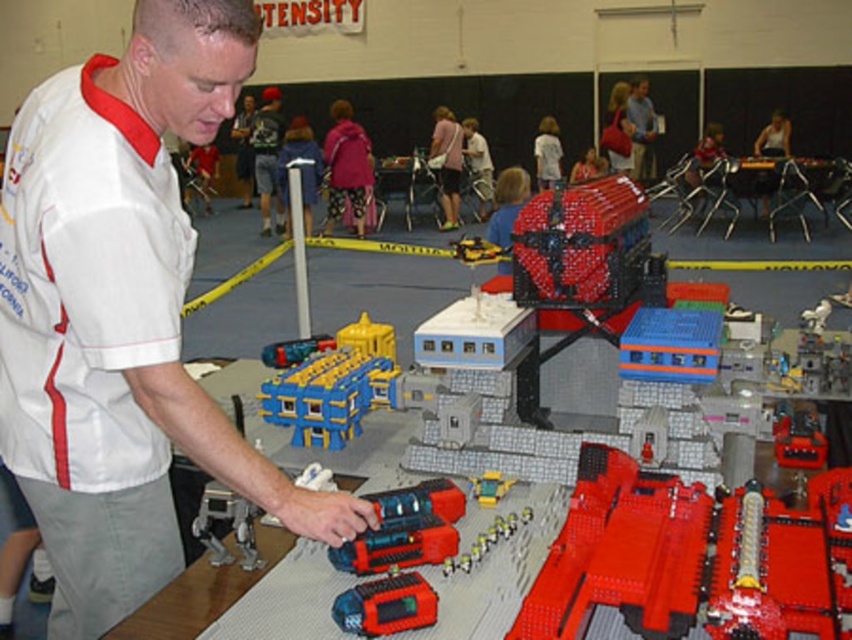
Question: Among these points, which one is farthest from the camera?

Choices:
 (A) (707, 368)
 (B) (332, 417)

Answer: (B)

Question: Is matte white shirt at upper center wider than translucent yellow plastic car at center?

Choices:
 (A) yes
 (B) no

Answer: (A)

Question: Considering the relative positions of white matte shirt at upper left and blue plastic train at center in the image provided, where is white matte shirt at upper left located with respect to blue plastic train at center?

Choices:
 (A) right
 (B) left

Answer: (B)

Question: Can you confirm if red plastic table at center is positioned to the left of matte white shirt at upper left?

Choices:
 (A) no
 (B) yes

Answer: (A)

Question: Estimate the real-world distances between objects in this image. Which object is farther from the blue plastic train at center?

Choices:
 (A) matte white shirt at upper left
 (B) red plastic table at center
 (C) white matte shirt at upper left

Answer: (A)

Question: Which is nearer to the matte white shirt at upper center?

Choices:
 (A) dark blue shirt at center
 (B) blue plastic building at center

Answer: (A)